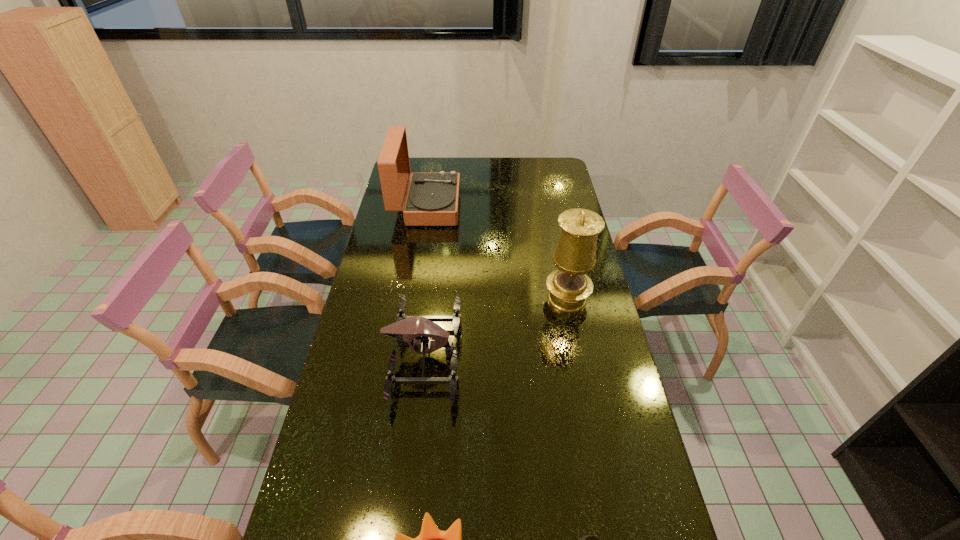
Locate an element on the screen. This screenshot has width=960, height=540. blank area in the image that satisfies the following two spatial constraints: 1. on the face of the second tallest object; 2. on the left side of the oil lamp is located at coordinates (412, 298).

Where is `vacant area in the image that satisfies the following two spatial constraints: 1. on the back side of the tallest object; 2. on the face of the second tallest object`? The height and width of the screenshot is (540, 960). vacant area in the image that satisfies the following two spatial constraints: 1. on the back side of the tallest object; 2. on the face of the second tallest object is located at coordinates (549, 206).

Locate an element on the screen. free space that satisfies the following two spatial constraints: 1. on the face of the phonograph record; 2. on the left side of the tallest object is located at coordinates pyautogui.click(x=412, y=298).